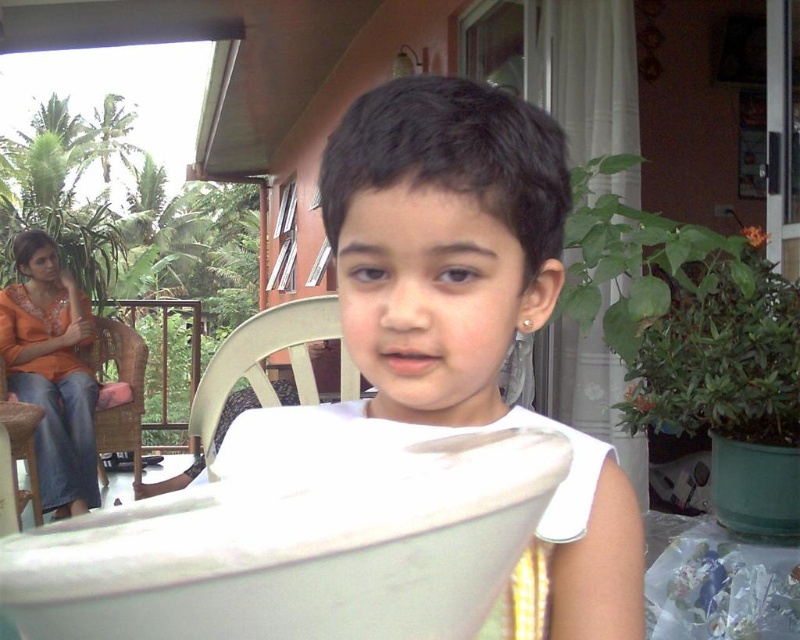
You are standing on a balcony and want to sit down. Where is the wooden chair at center located?

The wooden chair at center is located at point 0.559 on the x axis and 0.333 on the y axis.